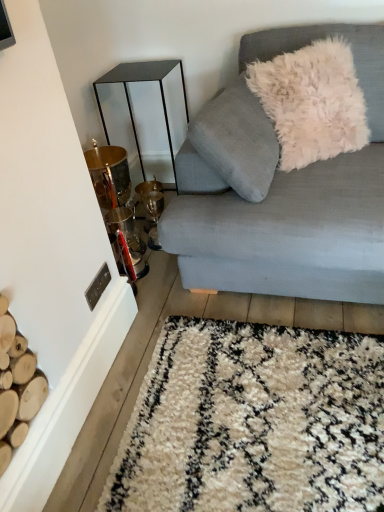
Question: From a real-world perspective, is light blue fabric couch at upper right above or below metallic gold table at left?

Choices:
 (A) below
 (B) above

Answer: (B)

Question: Considering the positions of light blue fabric couch at upper right and metallic gold table at left in the image, is light blue fabric couch at upper right wider or thinner than metallic gold table at left?

Choices:
 (A) thin
 (B) wide

Answer: (B)

Question: Which object is positioned closest to the light blue fabric couch at upper right?

Choices:
 (A) metallic gold table at left
 (B) white fluffy pillow at upper right

Answer: (B)

Question: Estimate the real-world distances between objects in this image. Which object is farther from the light blue fabric couch at upper right?

Choices:
 (A) metallic gold table at left
 (B) white fluffy pillow at upper right

Answer: (A)